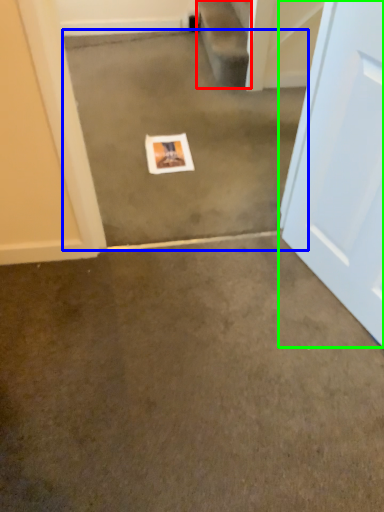
Question: Estimate the real-world distances between objects in this image. Which object is closer to stairwell (highlighted by a red box), concrete (highlighted by a blue box) or door (highlighted by a green box)?

Choices:
 (A) concrete
 (B) door

Answer: (A)